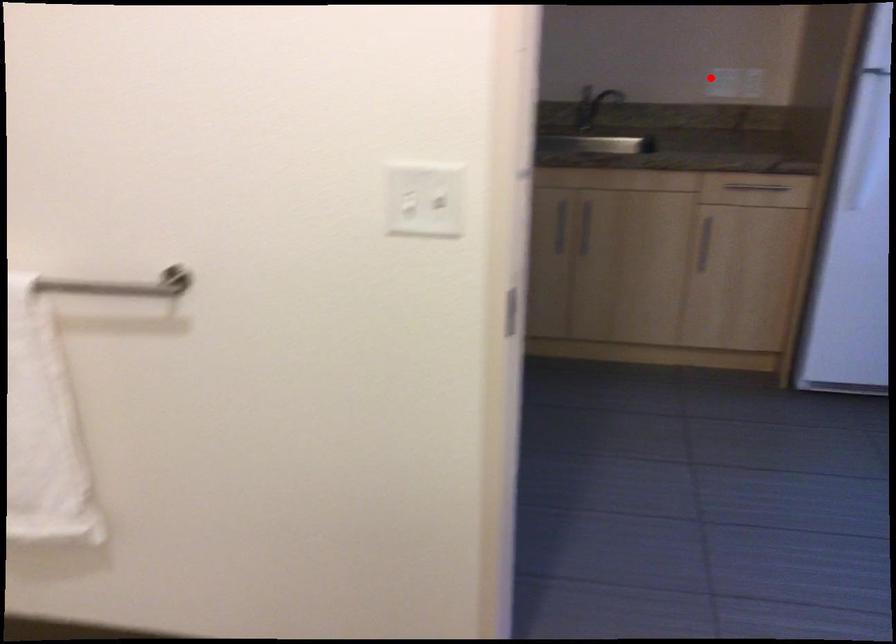
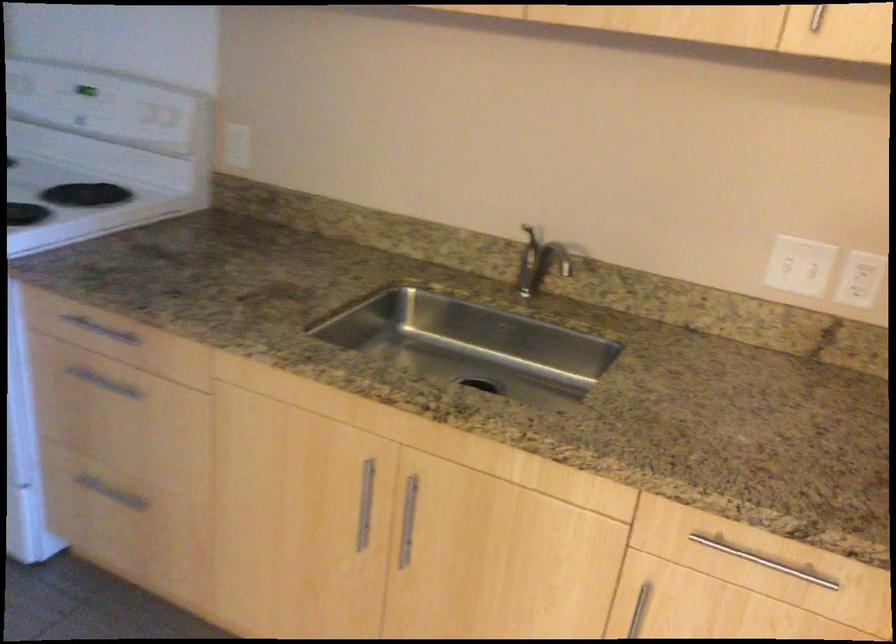
Question: A red point is marked in image1. In image2, is the corresponding 3D point closer to the camera or farther? Reply with the corresponding letter.

Choices:
 (A) The corresponding 3D point is closer.
 (B) The corresponding 3D point is farther.

Answer: (A)